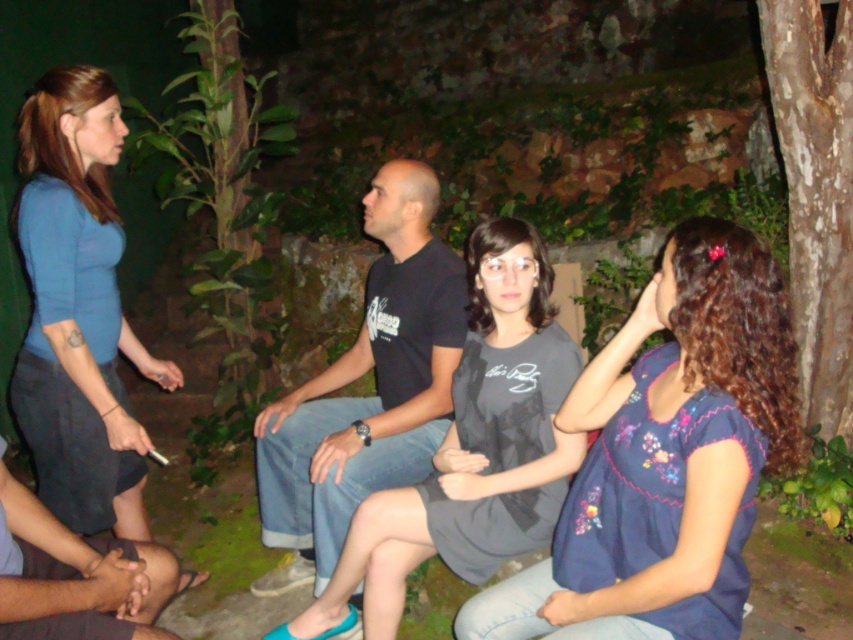
Question: Considering the relative positions of blue embroidered blouse at center and black cotton shirt at center in the image provided, where is blue embroidered blouse at center located with respect to black cotton shirt at center?

Choices:
 (A) above
 (B) below

Answer: (B)

Question: Which point appears farthest from the camera in this image?

Choices:
 (A) (71, 467)
 (B) (305, 429)
 (C) (578, 512)

Answer: (B)

Question: Where is blue embroidered blouse at center located in relation to blue fabric shirt at left in the image?

Choices:
 (A) right
 (B) left

Answer: (A)

Question: Which point appears farthest from the camera in this image?

Choices:
 (A) (433, 417)
 (B) (107, 116)
 (C) (3, 506)

Answer: (A)

Question: Is blue fabric shirt at left further to the viewer compared to black cotton shirt at center?

Choices:
 (A) no
 (B) yes

Answer: (A)

Question: Among these objects, which one is nearest to the camera?

Choices:
 (A) smooth black hands at lower left
 (B) blue fabric shirt at left
 (C) blue embroidered blouse at center
 (D) black cotton shirt at center

Answer: (C)